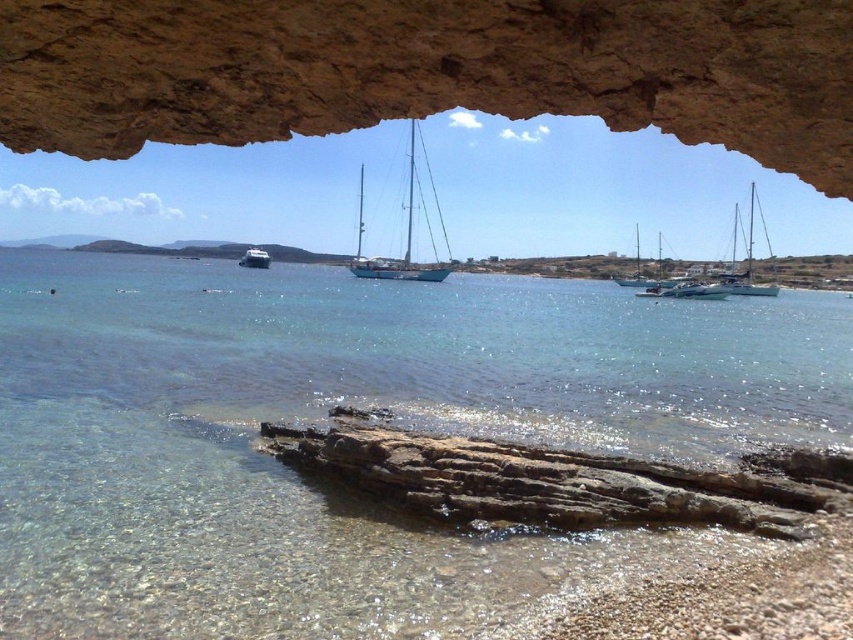
Question: Which point is closer to the camera?

Choices:
 (A) white glossy boat at center
 (B) white glossy sailboat at center
 (C) white glossy sailboat at right

Answer: (C)

Question: Based on their relative distances, which object is nearer to the white matte sailboat at center?

Choices:
 (A) white glossy sailboat at right
 (B) white glossy sailboat at center
 (C) clear water at lower center

Answer: (B)

Question: Is the position of white glossy sailboat at right less distant than that of white glossy boat at center?

Choices:
 (A) yes
 (B) no

Answer: (A)

Question: From the image, what is the correct spatial relationship of clear water at lower center in relation to white glossy sailboat at right?

Choices:
 (A) below
 (B) above

Answer: (A)

Question: Is clear water at lower center positioned in front of white glossy boat at center?

Choices:
 (A) no
 (B) yes

Answer: (B)

Question: Which of the following is the closest to the observer?

Choices:
 (A) white glossy sailboat at center
 (B) white glossy boat at center

Answer: (A)